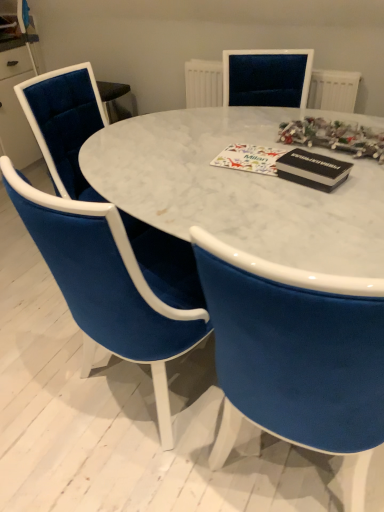
Question: Should I look upward or downward to see velvet blue chair at center, which ranks as the 1th chair in front-to-back order?

Choices:
 (A) down
 (B) up

Answer: (A)

Question: Is velvet blue chair at center, which ranks as the 1th chair in front-to-back order, at the back of white matte christmas card at center?

Choices:
 (A) yes
 (B) no

Answer: (B)

Question: Can you confirm if white matte christmas card at center is smaller than velvet blue chair at center, which ranks as the 1th chair in front-to-back order?

Choices:
 (A) no
 (B) yes

Answer: (B)

Question: Is white matte christmas card at center to the right of velvet blue chair at center, which ranks as the 1th chair in front-to-back order, from the viewer's perspective?

Choices:
 (A) no
 (B) yes

Answer: (B)

Question: Is white matte christmas card at center shorter than velvet blue chair at center, which ranks as the 1th chair in front-to-back order?

Choices:
 (A) no
 (B) yes

Answer: (B)

Question: Is white matte christmas card at center thinner than velvet blue chair at center, placed as the second chair when sorted from back to front?

Choices:
 (A) yes
 (B) no

Answer: (A)

Question: Does white matte christmas card at center lie in front of velvet blue chair at center, placed as the second chair when sorted from back to front?

Choices:
 (A) yes
 (B) no

Answer: (B)

Question: Is velvet blue chair at center, which ranks as the 1th chair in front-to-back order, taller than white textured radiator at upper center?

Choices:
 (A) no
 (B) yes

Answer: (B)

Question: From a real-world perspective, is velvet blue chair at center, which ranks as the 1th chair in front-to-back order, positioned under white textured radiator at upper center based on gravity?

Choices:
 (A) no
 (B) yes

Answer: (B)

Question: Does velvet blue chair at center, which ranks as the 1th chair in front-to-back order, turn towards white textured radiator at upper center?

Choices:
 (A) yes
 (B) no

Answer: (A)

Question: Is velvet blue chair at center, which ranks as the 1th chair in front-to-back order, to the right of white textured radiator at upper center from the viewer's perspective?

Choices:
 (A) no
 (B) yes

Answer: (A)

Question: From the image's perspective, would you say velvet blue chair at center, which ranks as the 1th chair in front-to-back order, is shown under white textured radiator at upper center?

Choices:
 (A) yes
 (B) no

Answer: (A)

Question: Is velvet blue chair at center, which ranks as the 1th chair in front-to-back order, at the left side of white textured radiator at upper center?

Choices:
 (A) yes
 (B) no

Answer: (A)

Question: Is white marble table at center thinner than black matte magazine at upper right?

Choices:
 (A) yes
 (B) no

Answer: (B)